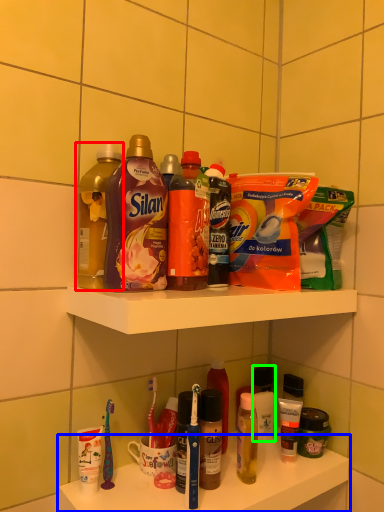
Question: Which object is positioned closest to bottle (highlighted by a red box)? Select from supermarket shelf (highlighted by a blue box) and toiletry (highlighted by a green box).

Choices:
 (A) supermarket shelf
 (B) toiletry

Answer: (A)